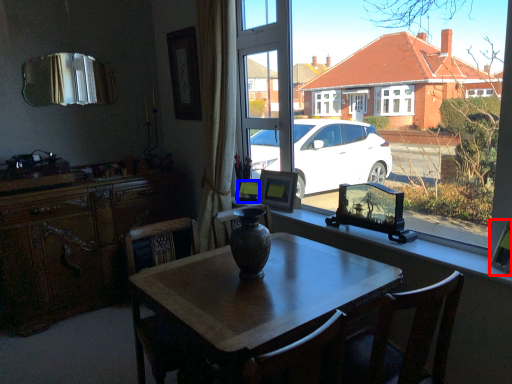
Question: Which object is further to the camera taking this photo, picture frame (highlighted by a red box) or picture frame (highlighted by a blue box)?

Choices:
 (A) picture frame
 (B) picture frame

Answer: (B)